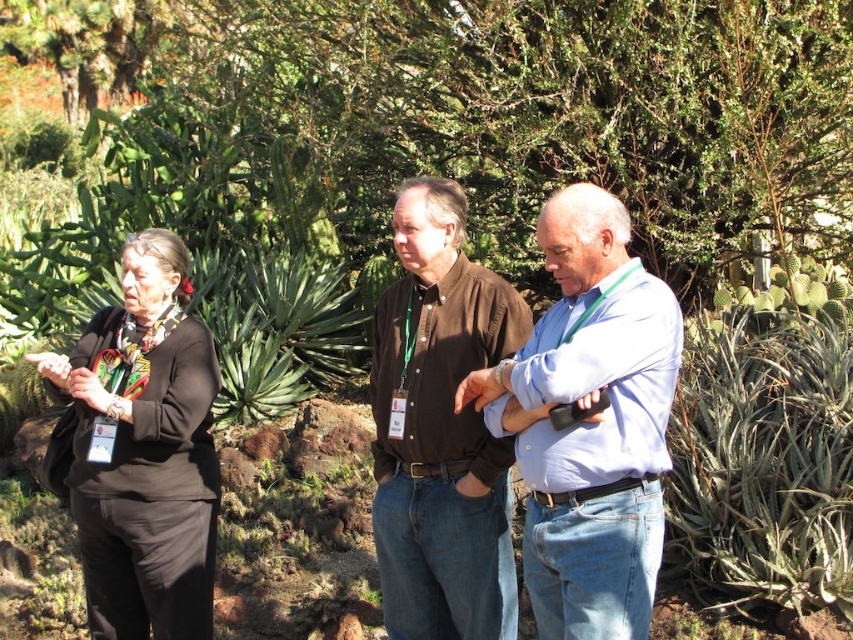
Question: Is light blue shirt at center thinner than green spiky plant at right?

Choices:
 (A) yes
 (B) no

Answer: (A)

Question: Which point is farther to the camera?

Choices:
 (A) (199, 570)
 (B) (751, 616)
 (C) (500, 483)

Answer: (B)

Question: Which of the following is the closest to the observer?

Choices:
 (A) light blue shirt at center
 (B) green spiky plant at right
 (C) brown cotton shirt at center

Answer: (A)

Question: Is brown cotton shirt at center above black fabric at left?

Choices:
 (A) no
 (B) yes

Answer: (B)

Question: Estimate the real-world distances between objects in this image. Which object is closer to the green spiky plant at right?

Choices:
 (A) black fabric at left
 (B) light blue shirt at center

Answer: (B)

Question: Can you confirm if light blue shirt at center is wider than green spiky plant at right?

Choices:
 (A) no
 (B) yes

Answer: (A)